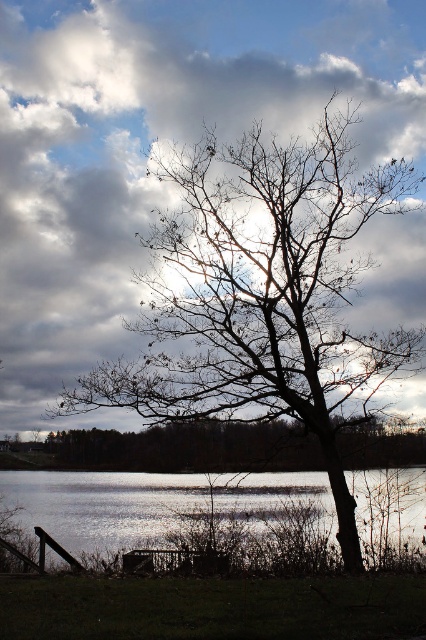
Question: Is bare branches at center bigger than silvery reflective water at lower center?

Choices:
 (A) yes
 (B) no

Answer: (B)

Question: Which point is closer to the camera taking this photo?

Choices:
 (A) (331, 358)
 (B) (258, 500)

Answer: (A)

Question: Which object is closer to the camera taking this photo?

Choices:
 (A) silvery reflective water at lower center
 (B) bare branches at center

Answer: (A)

Question: Which object appears farthest from the camera in this image?

Choices:
 (A) silvery reflective water at lower center
 (B) bare branches at center

Answer: (B)

Question: Is bare branches at center positioned at the back of silvery reflective water at lower center?

Choices:
 (A) yes
 (B) no

Answer: (A)

Question: Can you confirm if bare branches at center is positioned to the right of silvery reflective water at lower center?

Choices:
 (A) yes
 (B) no

Answer: (B)